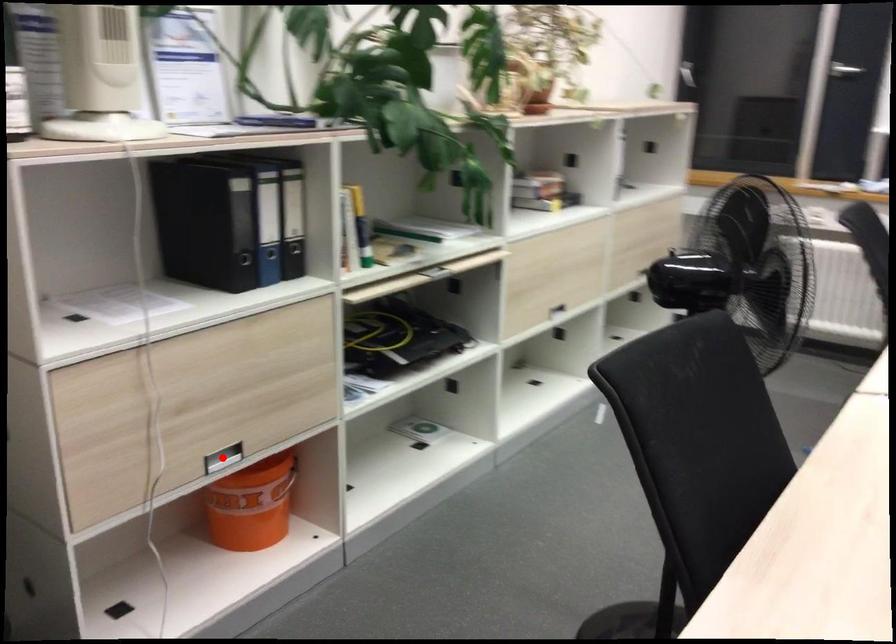
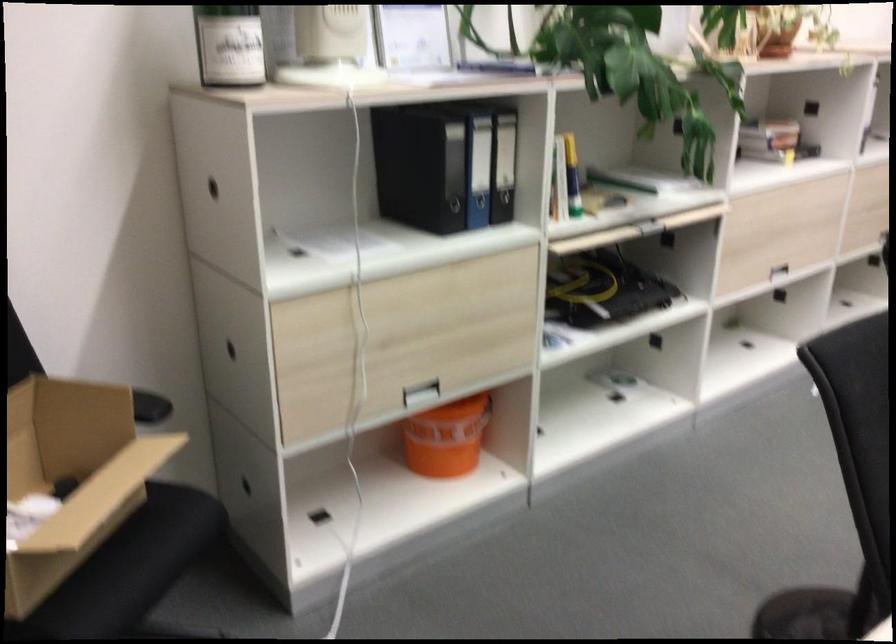
Where in the second image is the point corresponding to the highlighted location from the first image?

(419, 393)